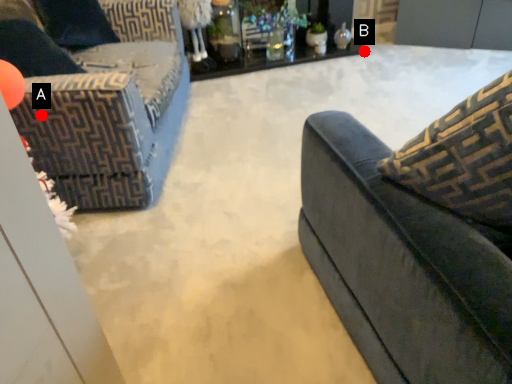
Question: Two points are circled on the image, labeled by A and B beside each circle. Which point appears farthest from the camera in this image?

Choices:
 (A) A is further
 (B) B is further

Answer: (B)